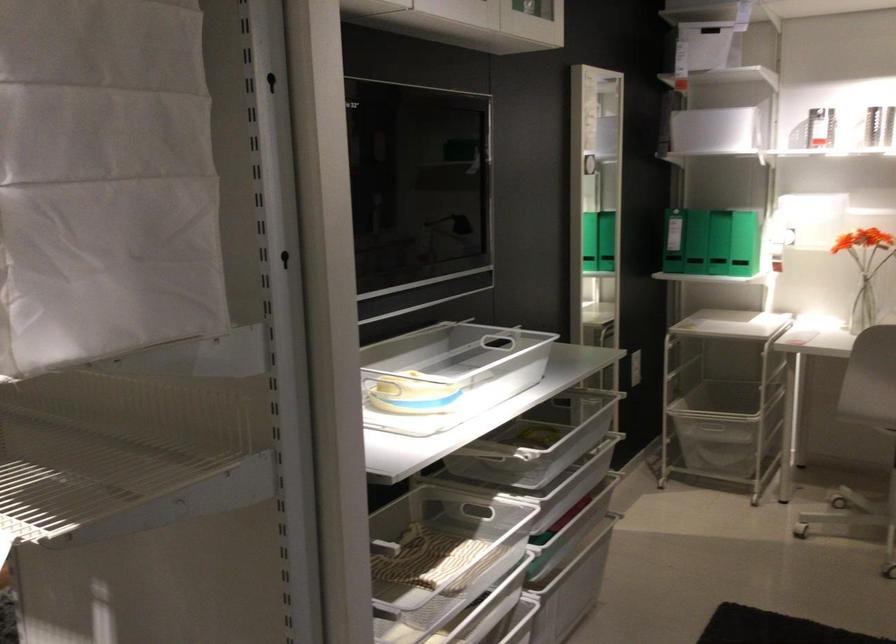
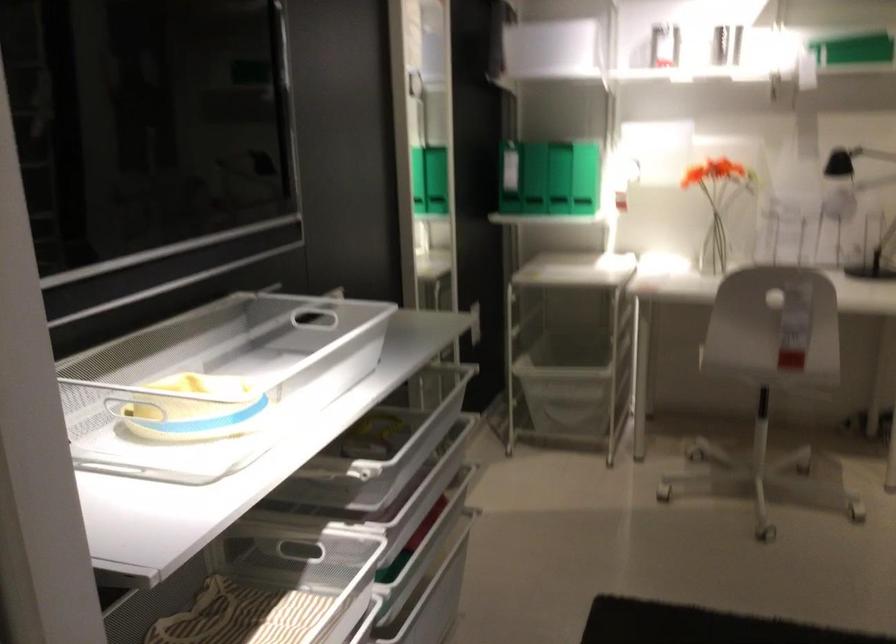
Where in the second image is the point corresponding to pixel 728 420 from the first image?

(566, 381)